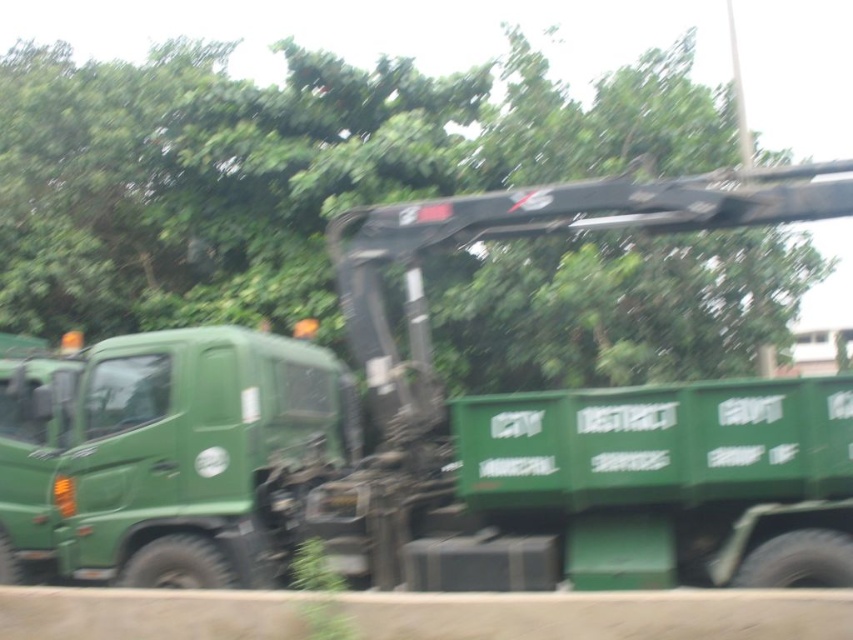
Question: Can you confirm if green matte tow truck at center is positioned above green matte tree at upper center?

Choices:
 (A) yes
 (B) no

Answer: (B)

Question: Does green matte tow truck at center appear on the left side of green matte tree at upper center?

Choices:
 (A) yes
 (B) no

Answer: (B)

Question: Which point is farther to the camera?

Choices:
 (A) green matte tree at upper center
 (B) green matte tow truck at center

Answer: (A)

Question: Among these objects, which one is nearest to the camera?

Choices:
 (A) green matte tow truck at center
 (B) green matte tree at upper center

Answer: (A)

Question: Is the position of green matte tow truck at center more distant than that of green matte tree at upper center?

Choices:
 (A) no
 (B) yes

Answer: (A)